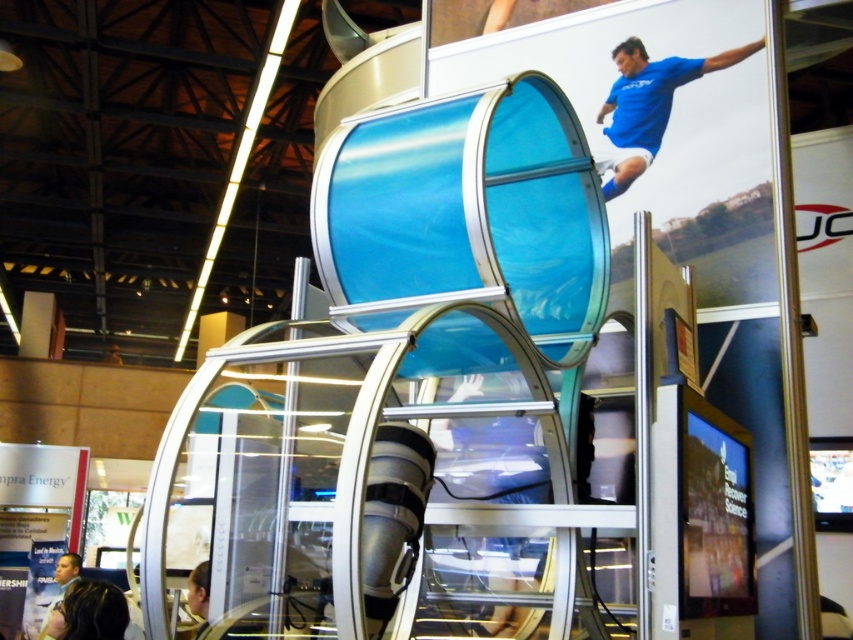
You are a photographer at the exhibition hall and want to capture a photo of the blue jersey at upper right and dark brown hair at lower left in the same frame. Based on their positions, which object should you focus on first to ensure both are in the frame?

The blue jersey at upper right is to the right of dark brown hair at lower left. To capture both in the same frame, focus on the dark brown hair at lower left first, then adjust the camera to include the blue jersey at upper right.

Based on the photo, in the image of the trade show exhibit, there is a blue jersey at upper right and a promotional poster in the background. Which object is closer to the point marked at coordinates (648, 104)?

The blue jersey at upper right is located at point (648, 104), so it is exactly at that coordinate.

In the scene shown: You are an event planner designing a layout for the trade show. You need to place a 1.2 meter wide banner between the blue jersey at upper right and the dark brown hair at lower left. Will the space between them accommodate the banner?

The blue jersey at upper right has a lesser width compared to dark brown hair at lower left. However, the question is about the space between them, not their individual widths. Since the description only provides information about their widths relative to each other, there isn not enough information to determine if the 1.2 meter banner will fit between them.